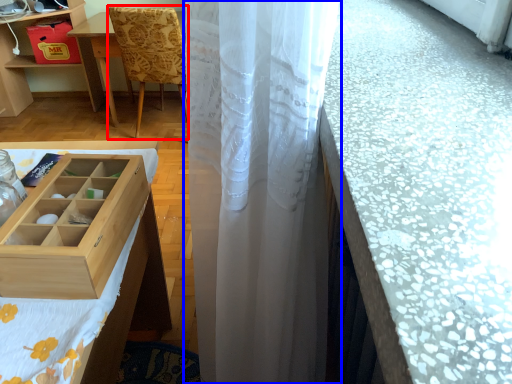
Question: Which point is further to the camera, chair (highlighted by a red box) or curtain (highlighted by a blue box)?

Choices:
 (A) chair
 (B) curtain

Answer: (A)